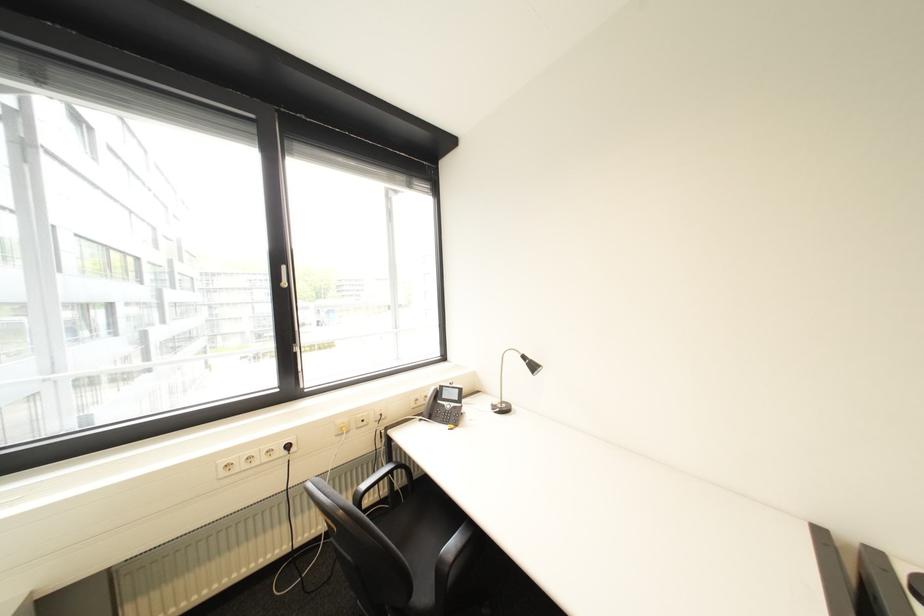
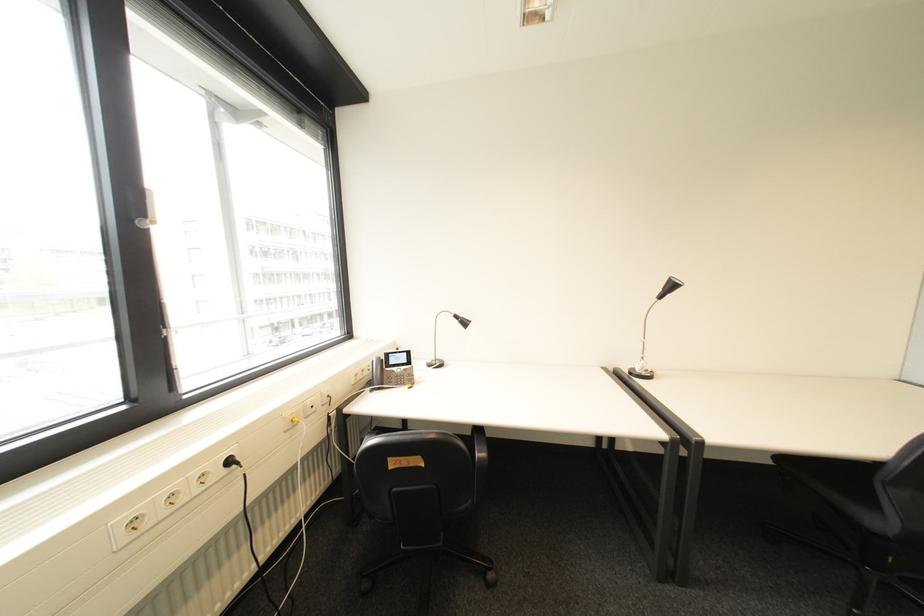
Question: The images are taken continuously from a first-person perspective. In which direction is your viewpoint rotating?

Choices:
 (A) Left
 (B) Right
 (C) Up
 (D) Down

Answer: (B)